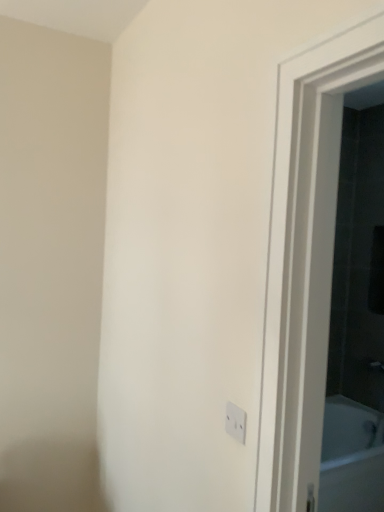
What do you see at coordinates (235, 422) in the screenshot? I see `white plastic electric outlet at lower right` at bounding box center [235, 422].

What are the coordinates of `white plastic electric outlet at lower right` in the screenshot? It's located at pyautogui.click(x=235, y=422).

In order to face white plastic electric outlet at lower right, should I rotate leftwards or rightwards?

A 5.721 degree turn to the right will do.

This screenshot has width=384, height=512. Identify the location of white plastic electric outlet at lower right. (235, 422).